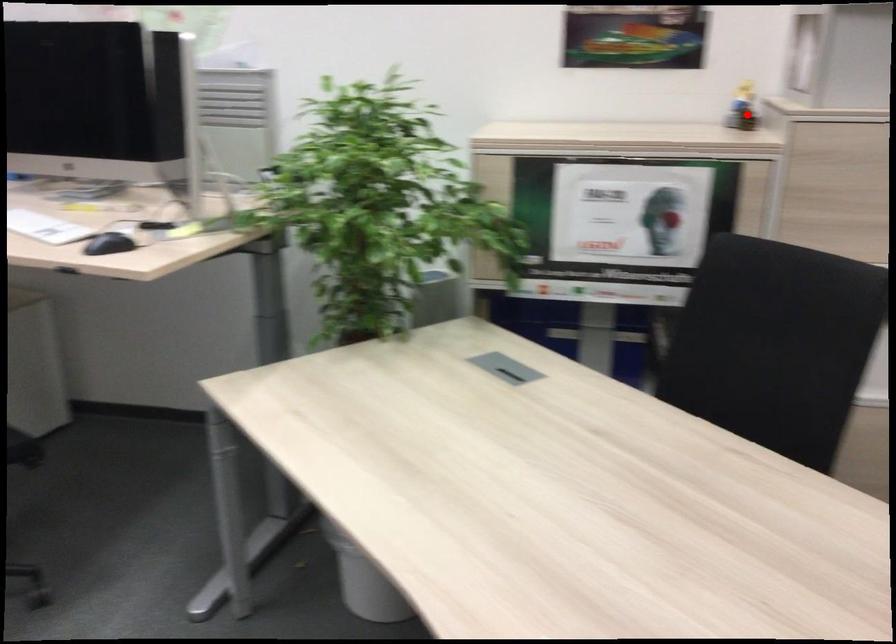
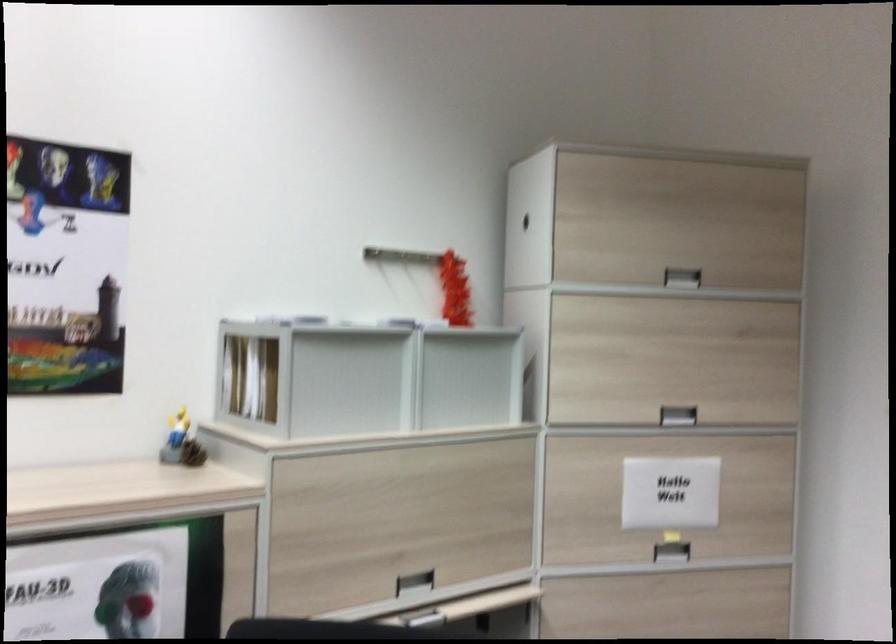
In the second image, find the point that corresponds to the highlighted location in the first image.

(192, 453)